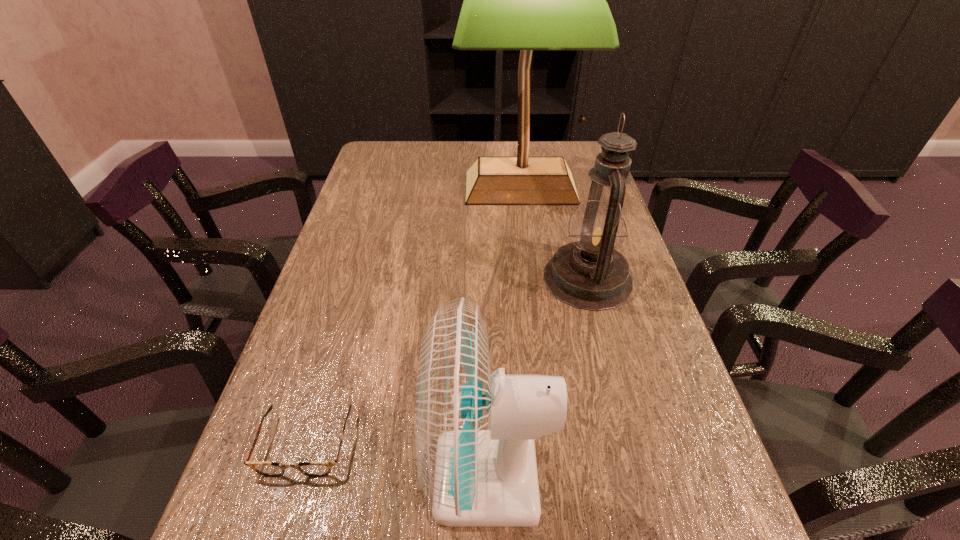
Identify the location of table lamp. (526, 0).

Locate an element on the screen. the farthest object is located at coordinates (526, 0).

You are a GUI agent. You are given a task and a screenshot of the screen. Output one action in this format:
    pyautogui.click(x=<x>, y=<y>)
    Task: Click on the third nearest object
    Image resolution: width=960 pixels, height=540 pixels.
    Given the screenshot: What is the action you would take?
    pyautogui.click(x=590, y=274)

At what (x,y) coordinates should I click in order to perform the action: click on spectacles. Please return your answer as a coordinate pair (x, y). The image size is (960, 540). Looking at the image, I should click on (273, 469).

You are a GUI agent. You are given a task and a screenshot of the screen. Output one action in this format:
    pyautogui.click(x=<x>, y=<y>)
    Task: Click on the leftmost object
    The image size is (960, 540).
    Given the screenshot: What is the action you would take?
    pyautogui.click(x=273, y=469)

Image resolution: width=960 pixels, height=540 pixels. I want to click on vacant space located on the metallic stand of the tallest object, so click(536, 305).

You are a GUI agent. You are given a task and a screenshot of the screen. Output one action in this format:
    pyautogui.click(x=<x>, y=<y>)
    Task: Click on the vacant space situated on the front of the oil lamp
    This screenshot has width=960, height=540.
    Given the screenshot: What is the action you would take?
    pyautogui.click(x=636, y=467)

In order to click on vacant space located 0.090m on the frame of the spectacles in this screenshot , I will do `click(276, 539)`.

Identify the location of object that is at the far edge. The image size is (960, 540). (526, 0).

Identify the location of object that is at the left edge. The width and height of the screenshot is (960, 540). (273, 469).